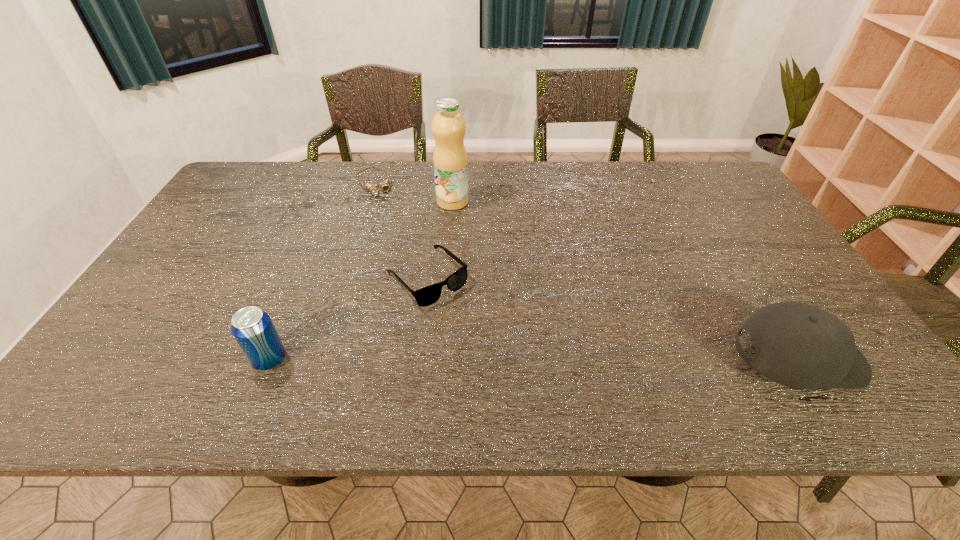
Find the location of a particular element. the leftmost object is located at coordinates (253, 329).

This screenshot has width=960, height=540. I want to click on baseball cap, so coord(797,345).

The height and width of the screenshot is (540, 960). Identify the location of the third farthest object. (428, 295).

This screenshot has width=960, height=540. Identify the location of the fourth tallest object. (428, 295).

What are the coordinates of `the second object from left to right` in the screenshot? It's located at (384, 185).

At what (x,y) coordinates should I click in order to perform the action: click on the shortest object. Please return your answer as a coordinate pair (x, y). The width and height of the screenshot is (960, 540). Looking at the image, I should click on (384, 185).

I want to click on fruit juice, so click(450, 161).

What are the coordinates of `free space located on the left of the leftmost object` in the screenshot? It's located at (120, 360).

Where is `vacant area located on the front-facing side of the second shortest object`? This screenshot has height=540, width=960. vacant area located on the front-facing side of the second shortest object is located at coordinates (510, 362).

I want to click on free region located 0.110m on the front-facing side of the second shortest object, so click(478, 330).